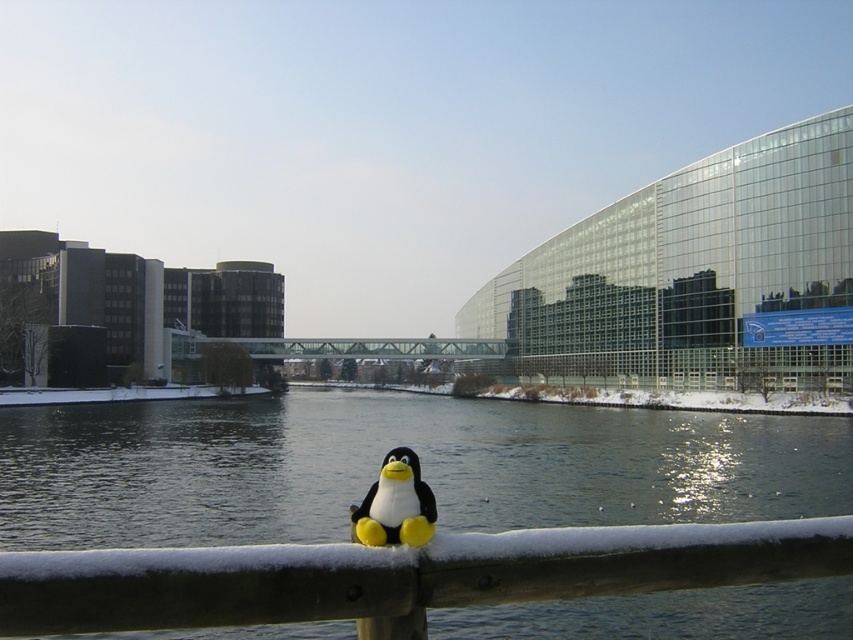
Question: Does snow-covered wooden rail at center have a greater width compared to matte plush penguin at center?

Choices:
 (A) no
 (B) yes

Answer: (B)

Question: Can you confirm if clear water at railing center is smaller than snow-covered wooden rail at center?

Choices:
 (A) no
 (B) yes

Answer: (A)

Question: Which of the following is the farthest from the observer?

Choices:
 (A) matte plush penguin at center
 (B) clear water at railing center

Answer: (A)

Question: Is clear water at railing center below snow-covered wooden rail at center?

Choices:
 (A) no
 (B) yes

Answer: (B)

Question: Which of the following is the closest to the observer?

Choices:
 (A) (129, 588)
 (B) (422, 534)
 (C) (326, 488)

Answer: (A)

Question: Based on their relative distances, which object is farther from the matte plush penguin at center?

Choices:
 (A) clear water at railing center
 (B) snow-covered wooden rail at center

Answer: (A)